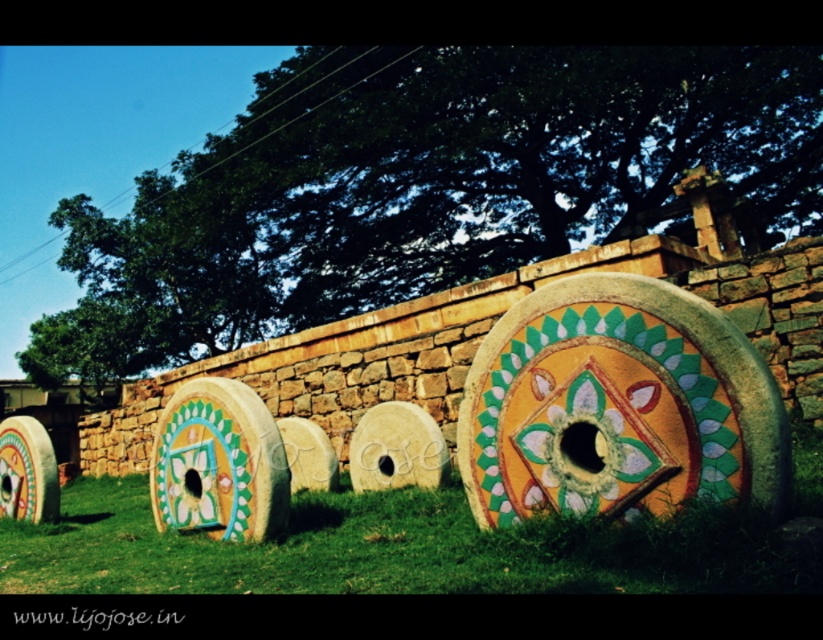
Who is positioned more to the left, green grass at center or matte painted wheel at center?

From the viewer's perspective, green grass at center appears more on the left side.

Is green grass at center bigger than matte painted wheel at center?

Correct, green grass at center is larger in size than matte painted wheel at center.

Does point (659, 536) come closer to viewer compared to point (475, 440)?

Yes, it is.

Where is `green grass at center`? The width and height of the screenshot is (823, 640). green grass at center is located at coordinates (394, 550).

Does green grass at center have a smaller size compared to matte painted wooden wheel at lower left?

No.

Who is higher up, green grass at center or matte painted wooden wheel at lower left?

matte painted wooden wheel at lower left is higher up.

Which is in front, point (345, 579) or point (54, 518)?

Positioned in front is point (345, 579).

The width and height of the screenshot is (823, 640). What are the coordinates of `green grass at center` in the screenshot? It's located at (394, 550).

Is matte painted wheel at center in front of matte painted wooden wheel at lower left?

Yes, matte painted wheel at center is in front of matte painted wooden wheel at lower left.

How much distance is there between matte painted wheel at center and matte painted wooden wheel at lower left?

matte painted wheel at center is 22.73 meters away from matte painted wooden wheel at lower left.

In the scene shown: Measure the distance between matte painted wheel at center and camera.

They are 12.70 meters apart.

This screenshot has width=823, height=640. I want to click on matte painted wheel at center, so click(617, 406).